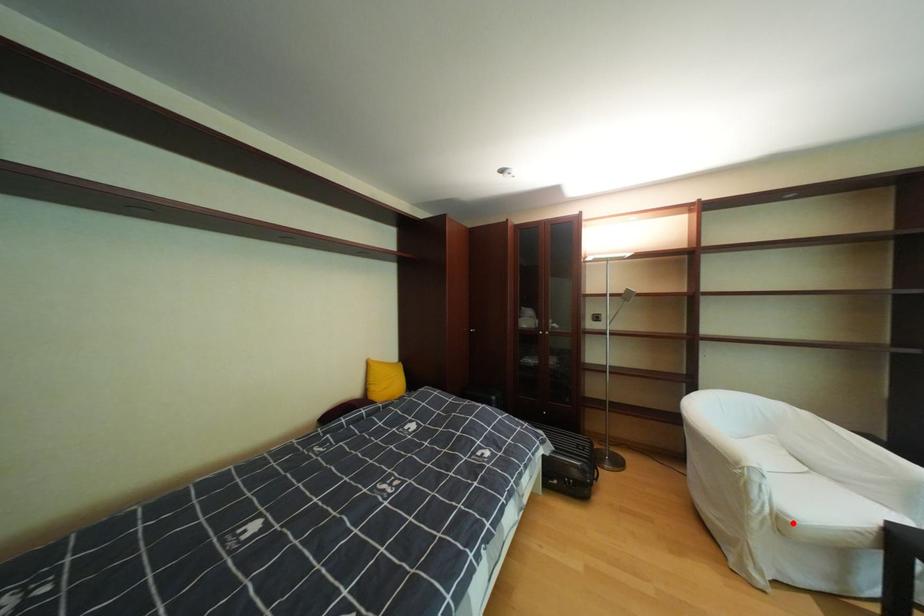
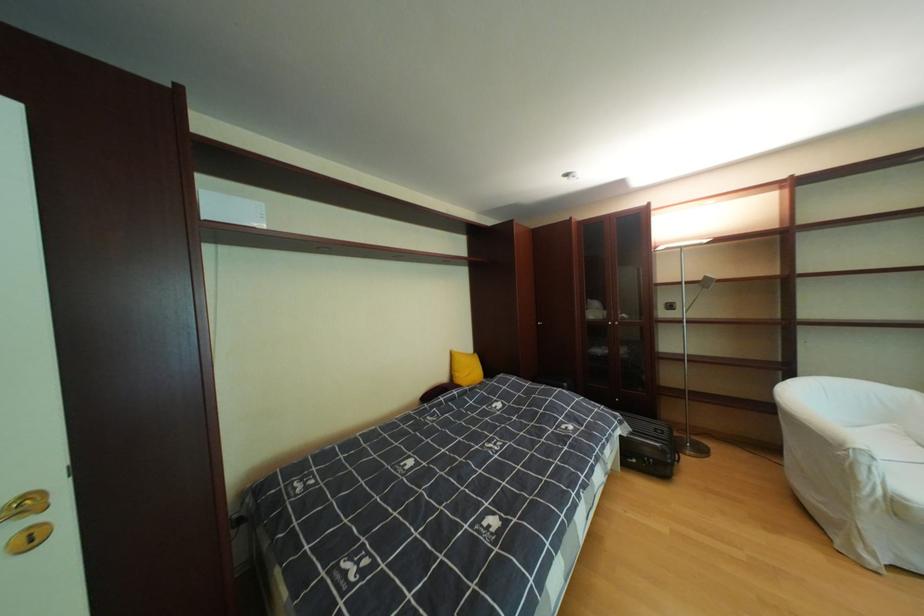
Question: A red point is marked in image1. In image2, is the corresponding 3D point closer to the camera or farther? Reply with the corresponding letter.

Choices:
 (A) The corresponding 3D point is closer.
 (B) The corresponding 3D point is farther.

Answer: (A)